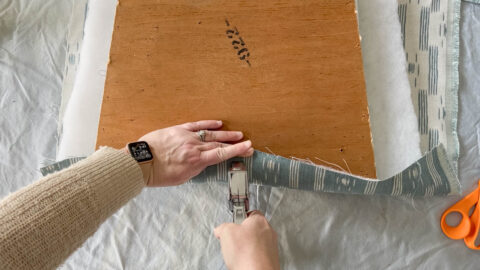
Image resolution: width=480 pixels, height=270 pixels. Find the location of `image of a person stapling fabric to a chair base`. image of a person stapling fabric to a chair base is located at coordinates (398, 146).